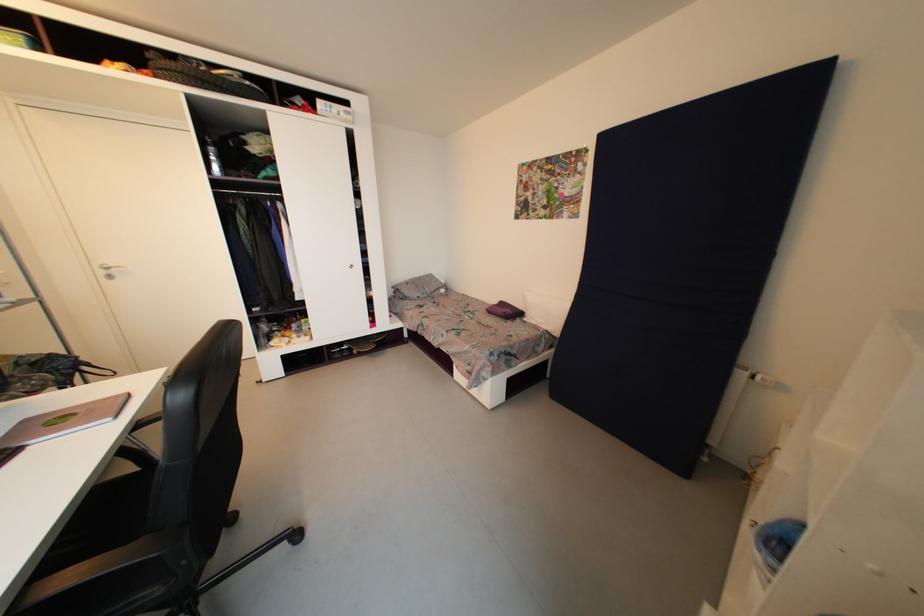
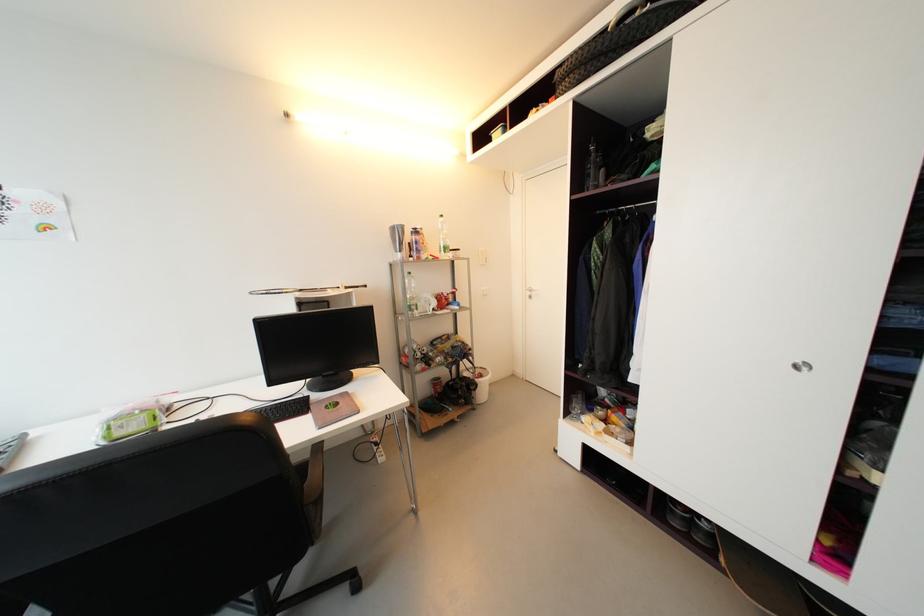
Find the pixel in the second image that matches (x=108, y=274) in the first image.

(533, 294)